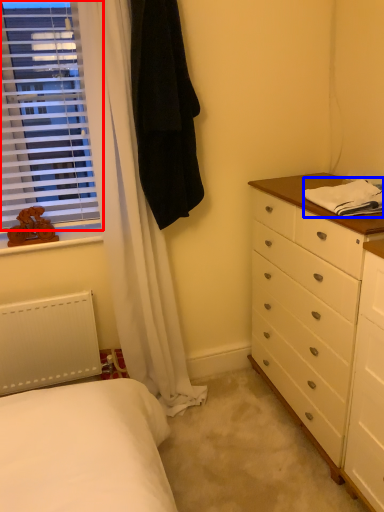
Question: Which object appears farthest to the camera in this image, window (highlighted by a red box) or blanket (highlighted by a blue box)?

Choices:
 (A) window
 (B) blanket

Answer: (A)